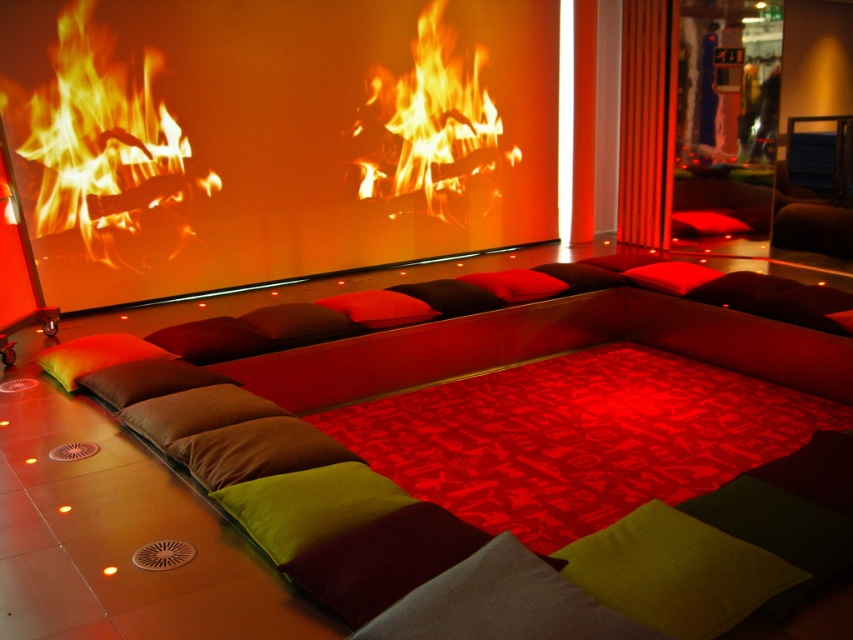
Question: Is orange matte fireplace at center bigger than dark brown cushion at center?

Choices:
 (A) yes
 (B) no

Answer: (A)

Question: Which of the following is the farthest from the observer?

Choices:
 (A) (94, 390)
 (B) (380, 308)
 (C) (654, 268)

Answer: (C)

Question: Is flamewood" at "left above green fabric pillow at lower center?

Choices:
 (A) yes
 (B) no

Answer: (A)

Question: Estimate the real-world distances between objects in this image. Which object is farther from the red matte pillow at center?

Choices:
 (A) flamewood" at "left
 (B) flamewooden logs at center
 (C) green fabric pillow at lower left

Answer: (B)

Question: Which point is closer to the camera?

Choices:
 (A) (726, 212)
 (B) (660, 264)
 (C) (338, 323)
 (D) (387, 164)

Answer: (C)

Question: In this image, where is orange matte fireplace at center located relative to green velvety pillow at center?

Choices:
 (A) above
 (B) below

Answer: (A)